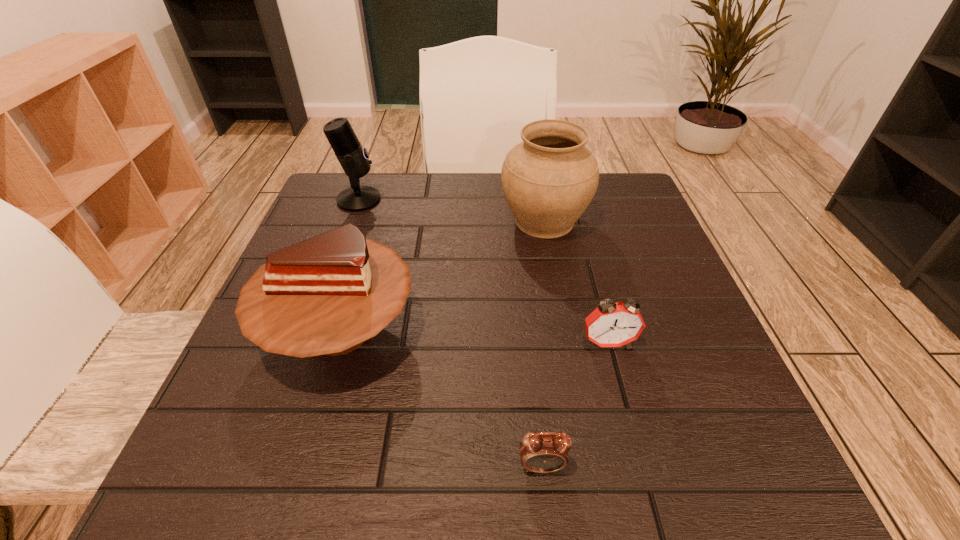
The width and height of the screenshot is (960, 540). Find the location of `urn`. urn is located at coordinates (549, 179).

Locate an element on the screen. The image size is (960, 540). microphone is located at coordinates (353, 158).

Find the location of a particular element. This screenshot has width=960, height=540. cake is located at coordinates (326, 295).

Locate an element on the screen. This screenshot has height=540, width=960. the fourth tallest object is located at coordinates (611, 324).

Find the location of a particular element. the taller alarm clock is located at coordinates (611, 324).

Where is `the shortest object`? This screenshot has width=960, height=540. the shortest object is located at coordinates (545, 452).

Locate an element on the screen. This screenshot has height=540, width=960. the nearer alarm clock is located at coordinates (545, 452).

Find the location of `vacant area situated on the left of the urn`. vacant area situated on the left of the urn is located at coordinates (406, 221).

Locate an element on the screen. Image resolution: width=960 pixels, height=540 pixels. vacant point located 0.350m on the stand of the microphone is located at coordinates (521, 200).

Locate an element on the screen. The image size is (960, 540). blank space located on the right of the cake is located at coordinates (535, 330).